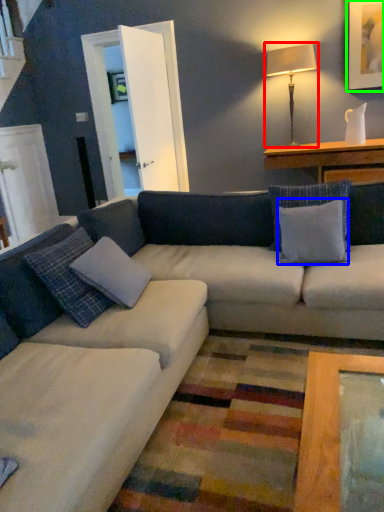
Question: Which object is the closest to the table lamp (highlighted by a red box)? Choose among these: pillow (highlighted by a blue box) or picture frame (highlighted by a green box).

Choices:
 (A) pillow
 (B) picture frame

Answer: (B)